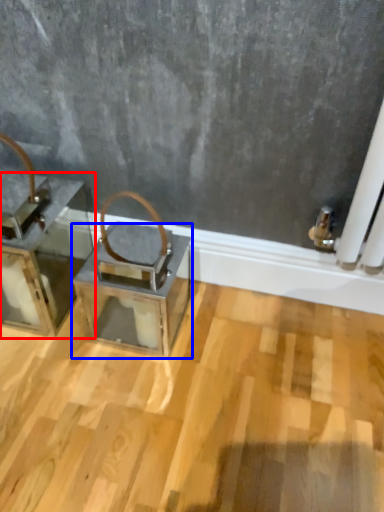
Question: Which point is closer to the camera, furniture (highlighted by a red box) or table (highlighted by a blue box)?

Choices:
 (A) furniture
 (B) table

Answer: (A)